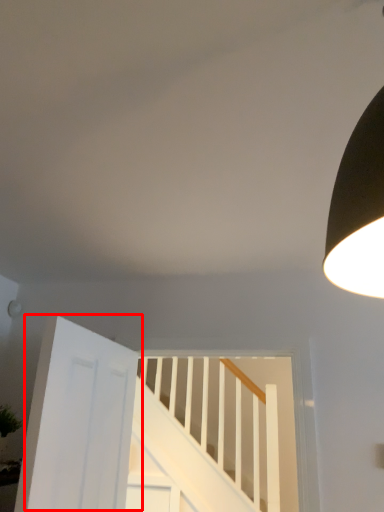
Question: From the image's perspective, what is the correct spatial positioning of door (annotated by the red box) in reference to stairs?

Choices:
 (A) below
 (B) above

Answer: (B)